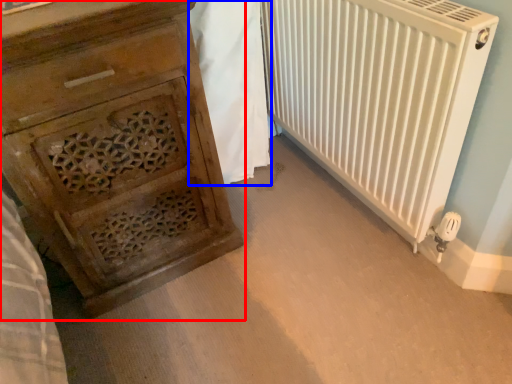
Question: Which object is closer to the camera taking this photo, chest of drawers (highlighted by a red box) or blanket (highlighted by a blue box)?

Choices:
 (A) chest of drawers
 (B) blanket

Answer: (A)